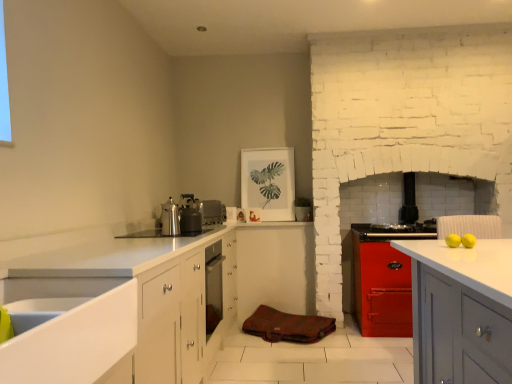
Question: Considering the relative sizes of shiny metallic kettle at center and metallic stove at center, which appears as the 3th appliance when viewed from the left, in the image provided, is shiny metallic kettle at center wider than metallic stove at center, which appears as the 3th appliance when viewed from the left,?

Choices:
 (A) no
 (B) yes

Answer: (A)

Question: Is shiny metallic kettle at center touching metallic stove at center, which is counted as the third appliance, starting from the front?

Choices:
 (A) no
 (B) yes

Answer: (A)

Question: Considering the relative positions of shiny metallic kettle at center and metallic stove at center, arranged as the 1th appliance when viewed from the right, in the image provided, is shiny metallic kettle at center to the left of metallic stove at center, arranged as the 1th appliance when viewed from the right, from the viewer's perspective?

Choices:
 (A) yes
 (B) no

Answer: (A)

Question: Considering the relative sizes of shiny metallic kettle at center and metallic stove at center, which is the 1th appliance from back to front, in the image provided, is shiny metallic kettle at center smaller than metallic stove at center, which is the 1th appliance from back to front,?

Choices:
 (A) yes
 (B) no

Answer: (A)

Question: Does shiny metallic kettle at center have a larger size compared to metallic stove at center, which appears as the 3th appliance when viewed from the left?

Choices:
 (A) no
 (B) yes

Answer: (A)

Question: Is shiny metallic kettle at center closer to camera compared to metallic stove at center, which is counted as the third appliance, starting from the front?

Choices:
 (A) yes
 (B) no

Answer: (A)

Question: Is shiny metallic kettle at center wider than metallic silver kettle at upper center, arranged as the first appliance when viewed from the left?

Choices:
 (A) no
 (B) yes

Answer: (A)

Question: From the image's perspective, is shiny metallic kettle at center beneath metallic silver kettle at upper center, the third appliance in the right-to-left sequence?

Choices:
 (A) no
 (B) yes

Answer: (B)

Question: Does shiny metallic kettle at center lie behind metallic silver kettle at upper center, arranged as the first appliance when viewed from the front?

Choices:
 (A) no
 (B) yes

Answer: (A)

Question: Can you confirm if shiny metallic kettle at center is bigger than metallic silver kettle at upper center, the third appliance in the back-to-front sequence?

Choices:
 (A) no
 (B) yes

Answer: (A)

Question: From the image's perspective, is shiny metallic kettle at center on top of metallic silver kettle at upper center, the third appliance in the right-to-left sequence?

Choices:
 (A) no
 (B) yes

Answer: (A)

Question: Is shiny metallic kettle at center closer to the viewer compared to metallic silver kettle at upper center, arranged as the first appliance when viewed from the front?

Choices:
 (A) yes
 (B) no

Answer: (A)

Question: From the image's perspective, is white glossy sink at lower left located beneath shiny metallic kettle at center?

Choices:
 (A) yes
 (B) no

Answer: (A)